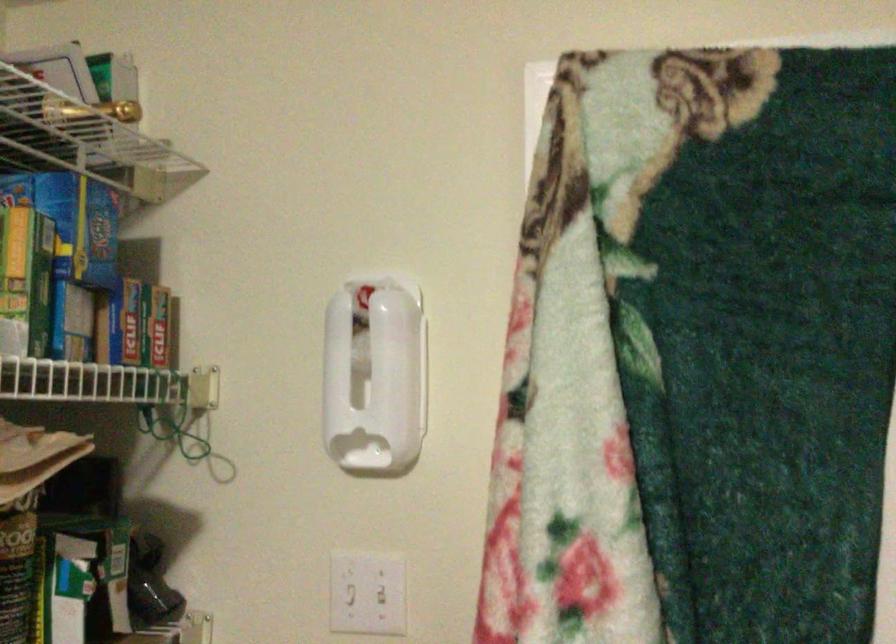
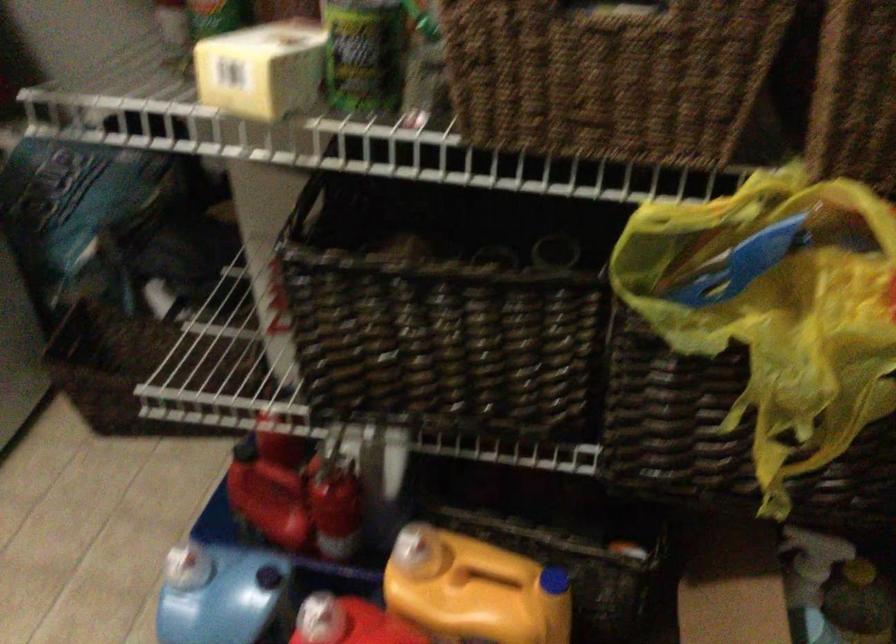
Based on the continuous images, in which direction is the camera rotating?

The rotation direction of the camera is left-down.